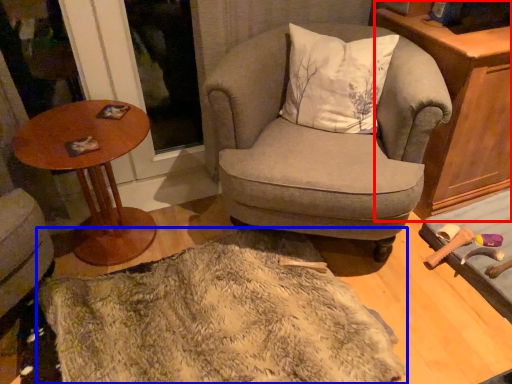
Question: Among these objects, which one is farthest to the camera, cabinetry (highlighted by a red box) or blanket (highlighted by a blue box)?

Choices:
 (A) cabinetry
 (B) blanket

Answer: (A)